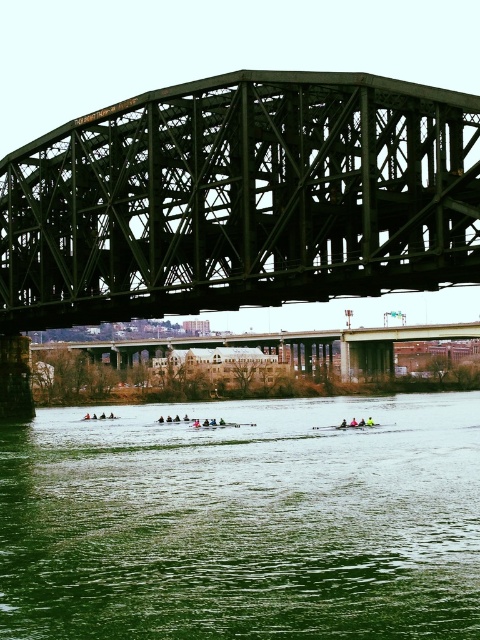
Is green water at lower center wider than green steel bridge at center?

In fact, green water at lower center might be narrower than green steel bridge at center.

Is green water at lower center smaller than green steel bridge at center?

No.

Does point (156, 524) come closer to viewer compared to point (269, 346)?

Yes, point (156, 524) is in front of point (269, 346).

Where is `green water at lower center`? This screenshot has width=480, height=640. green water at lower center is located at coordinates (243, 522).

Does green water at lower center have a greater height compared to green metal bridge at upper center?

A: No.

Which is behind, point (172, 468) or point (37, 195)?

The point (37, 195) is more distant.

Which is in front, point (179, 628) or point (94, 150)?

Point (179, 628)

Where is `green water at lower center`? green water at lower center is located at coordinates (243, 522).

Can you confirm if green metal bridge at upper center is shorter than green steel bridge at center?

In fact, green metal bridge at upper center may be taller than green steel bridge at center.

Which of these two, green metal bridge at upper center or green steel bridge at center, stands taller?

green metal bridge at upper center

Who is more distant from viewer, (x=157, y=152) or (x=365, y=371)?

The point (x=365, y=371) is more distant.

Image resolution: width=480 pixels, height=640 pixels. I want to click on green metal bridge at upper center, so click(240, 198).